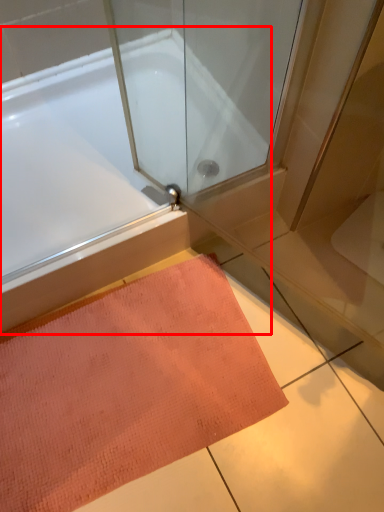
Question: From the image's perspective, what is the correct spatial positioning of bathtub (annotated by the red box) in reference to doormat?

Choices:
 (A) below
 (B) above

Answer: (B)